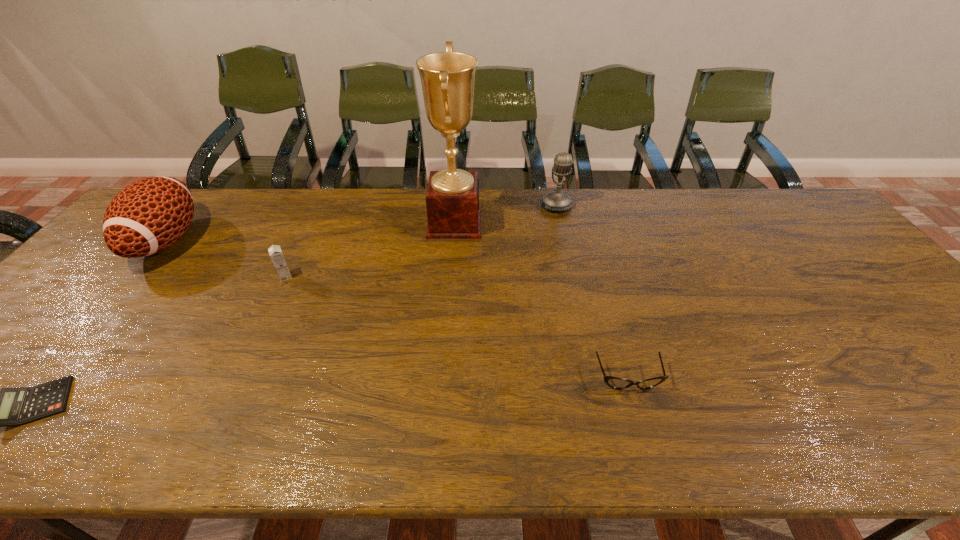
Where is `vacant space located 0.270m on the front of the chocolate milk`? The width and height of the screenshot is (960, 540). vacant space located 0.270m on the front of the chocolate milk is located at coordinates (244, 363).

The height and width of the screenshot is (540, 960). Find the location of `vacant space located on the front-facing side of the spectacles`. vacant space located on the front-facing side of the spectacles is located at coordinates (645, 436).

Where is `trophy cup present at the far edge`? trophy cup present at the far edge is located at coordinates (452, 200).

At what (x,y) coordinates should I click in order to perform the action: click on microphone that is at the far edge. Please return your answer as a coordinate pair (x, y). This screenshot has height=540, width=960. Looking at the image, I should click on 557,200.

This screenshot has width=960, height=540. In order to click on football that is at the far edge in this screenshot , I will do `click(148, 216)`.

What are the coordinates of `object at the left edge` in the screenshot? It's located at (148, 216).

The width and height of the screenshot is (960, 540). I want to click on object that is at the far left corner, so click(x=148, y=216).

Find the location of a particular element. The width and height of the screenshot is (960, 540). vacant area at the far edge is located at coordinates (302, 190).

Where is `vacant space at the near edge of the desktop`? Image resolution: width=960 pixels, height=540 pixels. vacant space at the near edge of the desktop is located at coordinates (268, 427).

Locate an element on the screen. The image size is (960, 540). vacant space at the right edge of the desktop is located at coordinates (946, 353).